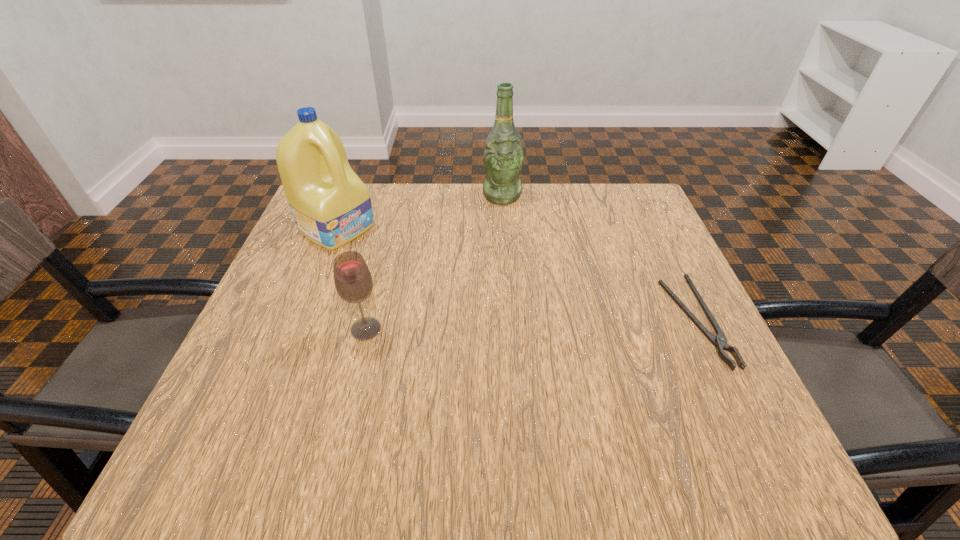
The width and height of the screenshot is (960, 540). In order to click on blank space at the near edge of the desktop in this screenshot , I will do `click(581, 404)`.

Identify the location of free space at the left edge of the desktop. The width and height of the screenshot is (960, 540). (313, 330).

The image size is (960, 540). In order to click on vacant space at the right edge of the desktop in this screenshot , I will do `click(612, 237)`.

Find the location of a particular element. vacant space that's between the shortest object and the beer bottle is located at coordinates (599, 259).

Identify the location of free space between the rightmost object and the glass drink container. Image resolution: width=960 pixels, height=540 pixels. (531, 326).

Where is `vacant point located between the rightmost object and the glass drink container`? This screenshot has height=540, width=960. vacant point located between the rightmost object and the glass drink container is located at coordinates (531, 326).

Where is `free space between the detergent and the second object from right to left`? The image size is (960, 540). free space between the detergent and the second object from right to left is located at coordinates click(420, 212).

Locate an element on the screen. This screenshot has height=540, width=960. empty location between the beer bottle and the rightmost object is located at coordinates (599, 259).

What are the coordinates of `free space that is in between the detergent and the beer bottle` in the screenshot? It's located at click(x=420, y=212).

At what (x,y) coordinates should I click in order to perform the action: click on free space between the shortest object and the beer bottle. Please return your answer as a coordinate pair (x, y). Looking at the image, I should click on pos(599,259).